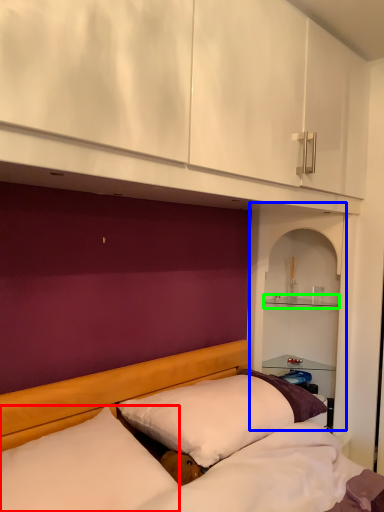
Question: Which is nearer to the pillow (highlighted by a red box)? shelf (highlighted by a blue box) or shelf (highlighted by a green box).

Choices:
 (A) shelf
 (B) shelf

Answer: (A)